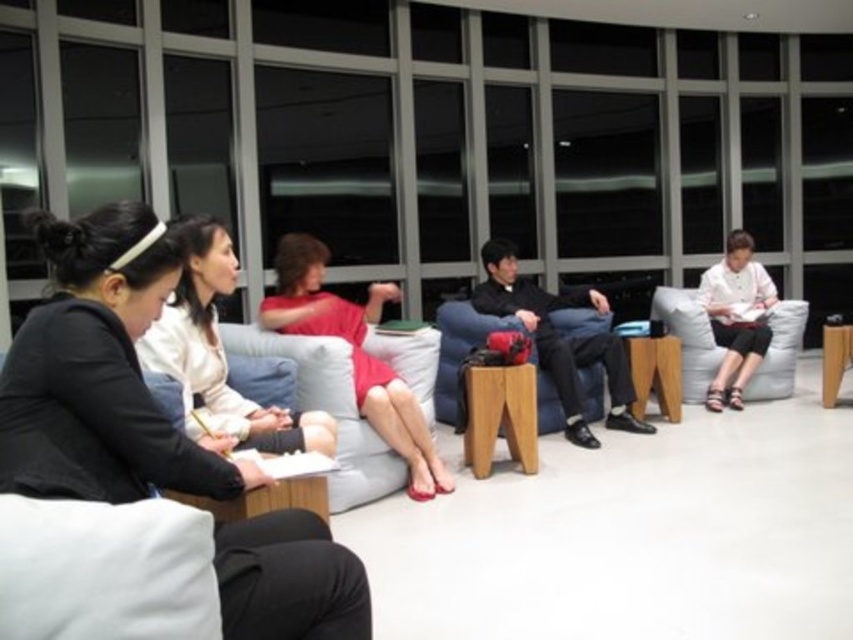
Question: Among these objects, which one is farthest from the camera?

Choices:
 (A) white matte shirt at right
 (B) matte black jacket at left

Answer: (A)

Question: Is the position of matte black jacket at left less distant than that of wooden stool at center?

Choices:
 (A) no
 (B) yes

Answer: (B)

Question: Does matte black jacket at left appear over matte black jacket at center?

Choices:
 (A) yes
 (B) no

Answer: (B)

Question: Which of these objects is positioned farthest from the matte black jacket at center?

Choices:
 (A) matte red dress at center
 (B) white fabric couch at right
 (C) white fabric couch at center
 (D) matte black jacket at left

Answer: (B)

Question: Can you confirm if matte black jacket at left is wider than white matte shirt at right?

Choices:
 (A) yes
 (B) no

Answer: (B)

Question: Which object appears farthest from the camera in this image?

Choices:
 (A) matte red dress at center
 (B) dark blue jeans at center

Answer: (B)